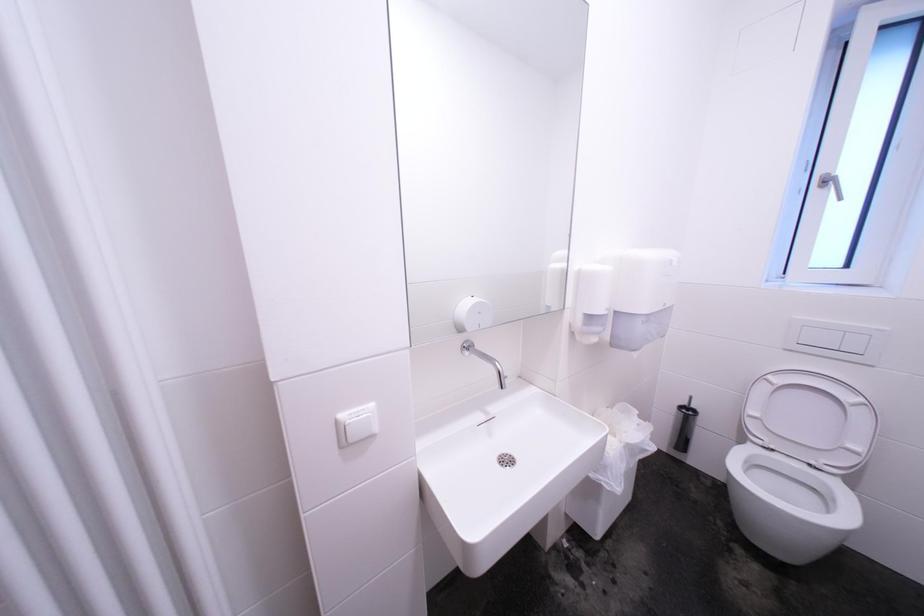
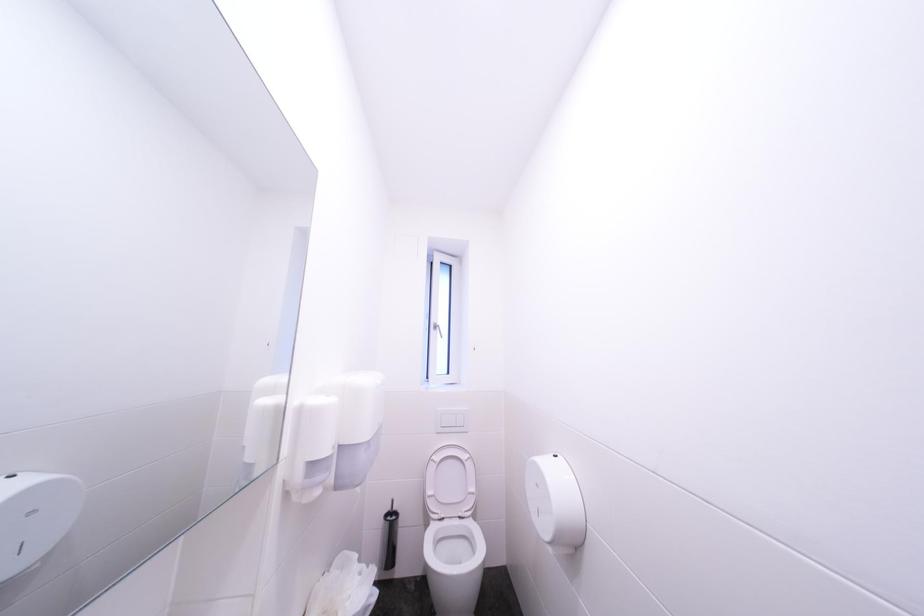
The images are taken continuously from a first-person perspective. In which direction is your viewpoint rotating?

The rotation direction of the camera is right-up.